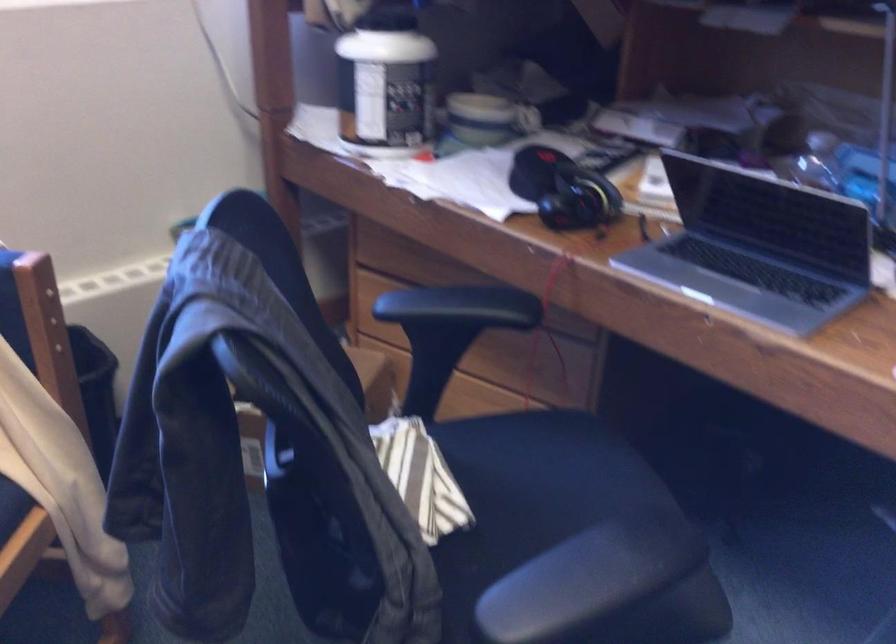
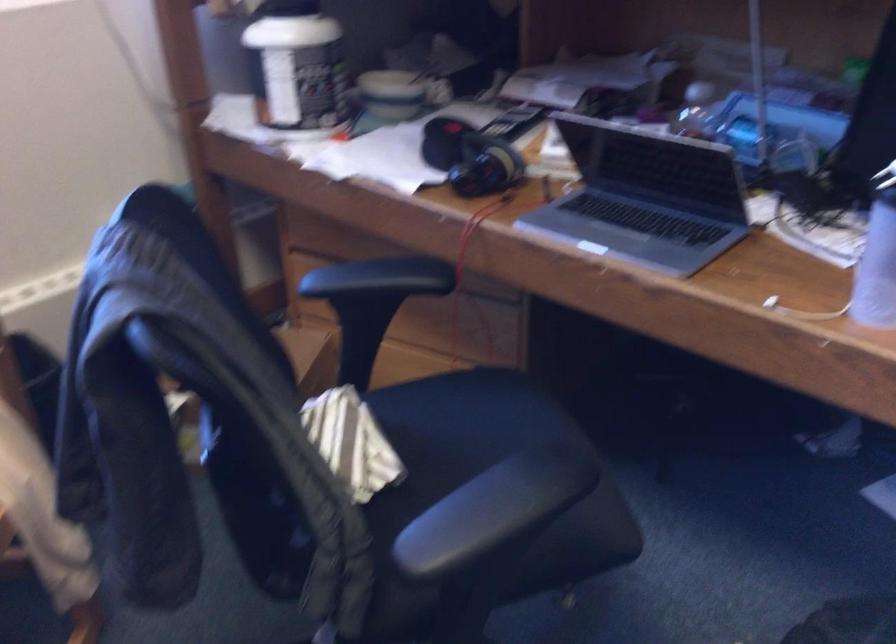
The point at (403, 270) is marked in the first image. Where is the corresponding point in the second image?

(333, 249)